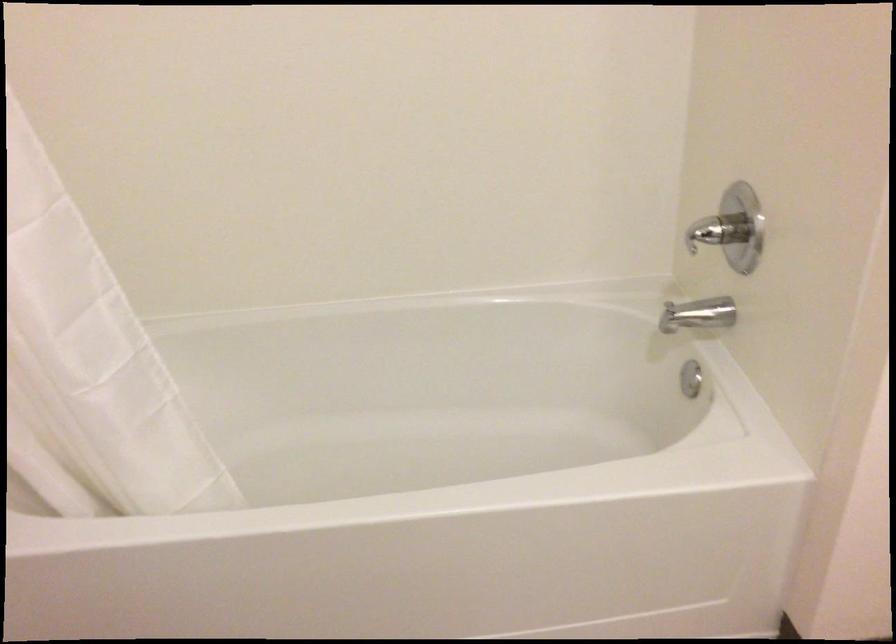
First-person continuous shooting, in which direction is the camera rotating?

The rotation direction of the camera is left-down.